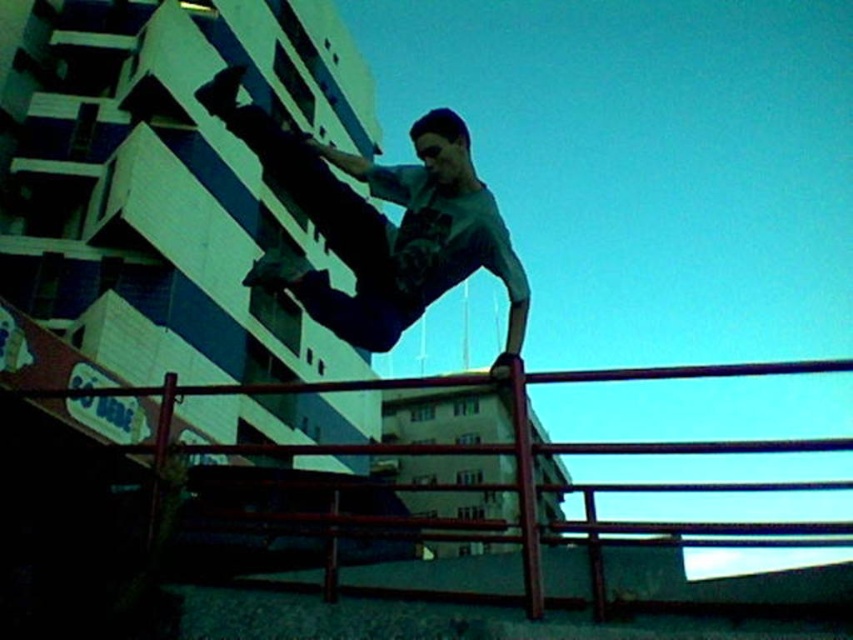
You are a photographer trying to capture the best angle of the person performing a trick on the smooth metal rail at center. Since the matte gray shirt at center is in the way, can you adjust your position to see the rail clearly?

The smooth metal rail at center is behind the matte gray shirt at center, so moving your position to the side or adjusting your angle could allow you to see the rail clearly without the shirt blocking it.

You are a safety inspector evaluating this scene. The matte gray shirt at center represents a person performing a stunt near the smooth metal rail at center. According to safety protocols, stunts must be performed at least 1 meter away from any metal structures. Can you determine if the stunt is compliant with safety regulations based on their positions?

The matte gray shirt at center is located above the smooth metal rail at center, which means they are in close proximity to the rail. Since the requirement is to stay at least 1 meter away, the stunt does not comply with safety regulations.

Based on the photo, you are a photographer taking a picture of the person performing the trick on the red metal railing. You notice a point at coordinates (380, 224) in your camera viewfinder. Based on the scene description, can you determine what object or part of the scene this point corresponds to?

The point at coordinates (380, 224) corresponds to the matte gray shirt at center.